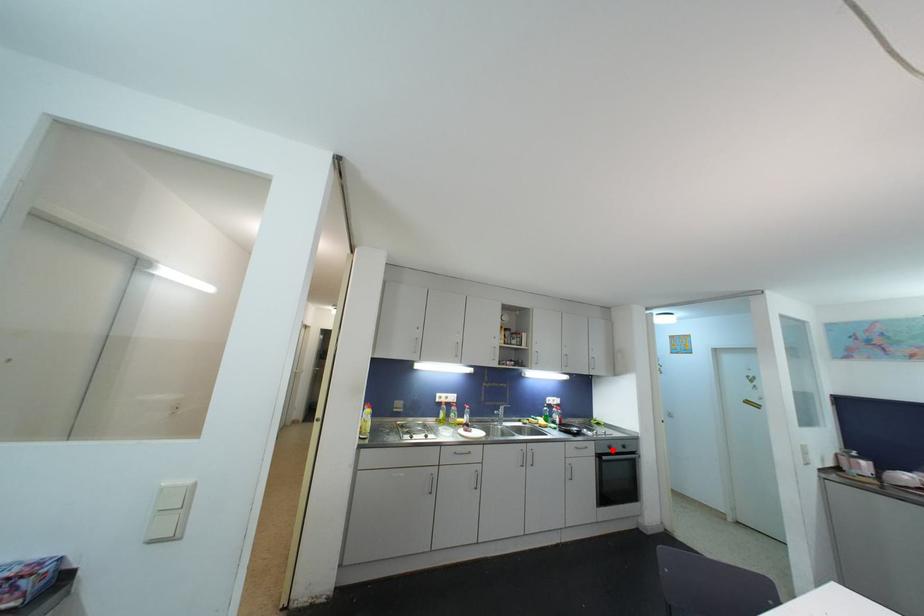
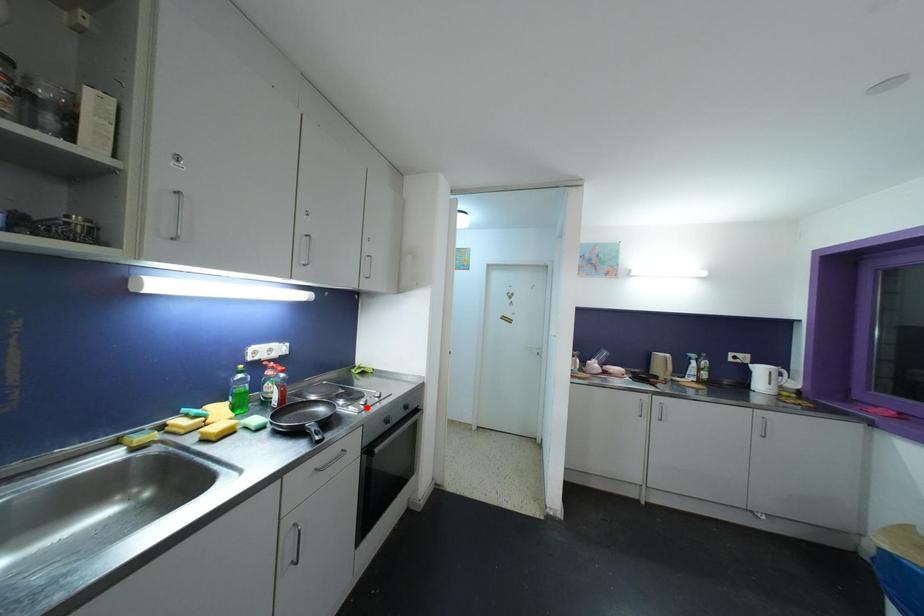
I am providing you with two images of the same scene from different viewpoints. A red point is marked on the first image and another point is marked on the second image. Do the highlighted points in image1 and image2 indicate the same real-world spot?

No